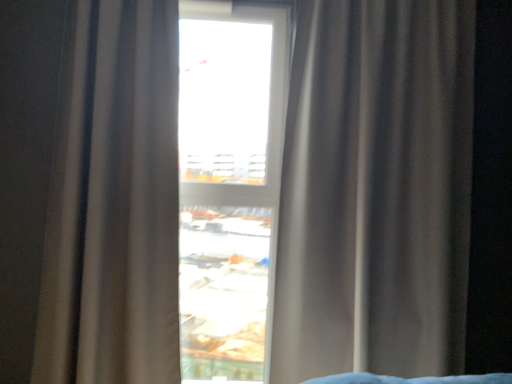
Question: In which direction should I rotate to look at satin beige curtain at center, arranged as the 2th curtain when viewed from the left?

Choices:
 (A) left
 (B) right

Answer: (B)

Question: Does satin beige curtain at center, arranged as the 2th curtain when viewed from the left, have a lesser height compared to transparent glass window at center?

Choices:
 (A) no
 (B) yes

Answer: (B)

Question: From the image's perspective, is satin beige curtain at center, which is the 1th curtain from right to left, beneath transparent glass window at center?

Choices:
 (A) yes
 (B) no

Answer: (B)

Question: Is the depth of satin beige curtain at center, which is the 1th curtain from right to left, greater than that of transparent glass window at center?

Choices:
 (A) yes
 (B) no

Answer: (B)

Question: Would you say transparent glass window at center is part of satin beige curtain at center, which is the 1th curtain from right to left,'s contents?

Choices:
 (A) no
 (B) yes

Answer: (A)

Question: Considering the relative positions of satin beige curtain at center, which is the 1th curtain from right to left, and transparent glass window at center in the image provided, is satin beige curtain at center, which is the 1th curtain from right to left, to the left of transparent glass window at center from the viewer's perspective?

Choices:
 (A) no
 (B) yes

Answer: (A)

Question: Does transparent glass window at center have a lesser height compared to satin beige curtain at center, which is the 1th curtain from right to left?

Choices:
 (A) no
 (B) yes

Answer: (A)

Question: Is transparent glass window at center smaller than satin beige curtain at center, arranged as the 2th curtain when viewed from the left?

Choices:
 (A) no
 (B) yes

Answer: (B)

Question: Considering the relative sizes of transparent glass window at center and satin beige curtain at center, arranged as the 2th curtain when viewed from the left, in the image provided, is transparent glass window at center thinner than satin beige curtain at center, arranged as the 2th curtain when viewed from the left,?

Choices:
 (A) yes
 (B) no

Answer: (A)

Question: Is transparent glass window at center positioned before satin beige curtain at center, which is the 1th curtain from right to left?

Choices:
 (A) no
 (B) yes

Answer: (A)

Question: Considering the relative positions of transparent glass window at center and satin beige curtain at center, arranged as the 2th curtain when viewed from the left, in the image provided, is transparent glass window at center to the right of satin beige curtain at center, arranged as the 2th curtain when viewed from the left, from the viewer's perspective?

Choices:
 (A) yes
 (B) no

Answer: (B)

Question: Is the surface of transparent glass window at center in direct contact with satin beige curtain at center, arranged as the 2th curtain when viewed from the left?

Choices:
 (A) no
 (B) yes

Answer: (A)

Question: Considering the relative sizes of satin beige curtain at center, which is the 1th curtain from right to left, and satin beige curtain at center, which appears as the 1th curtain when viewed from the left, in the image provided, is satin beige curtain at center, which is the 1th curtain from right to left, shorter than satin beige curtain at center, which appears as the 1th curtain when viewed from the left,?

Choices:
 (A) no
 (B) yes

Answer: (A)